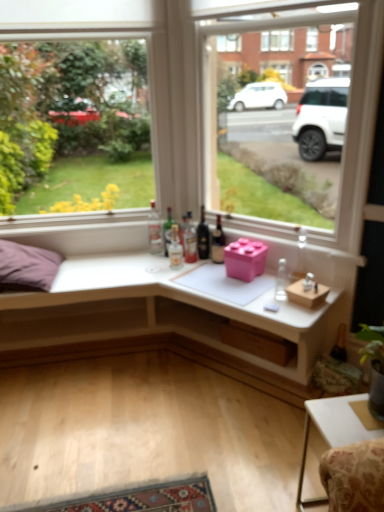
The image size is (384, 512). I want to click on blank area to the left of translucent glass bottle at center, the 5th bottle when ordered from right to left, so click(145, 268).